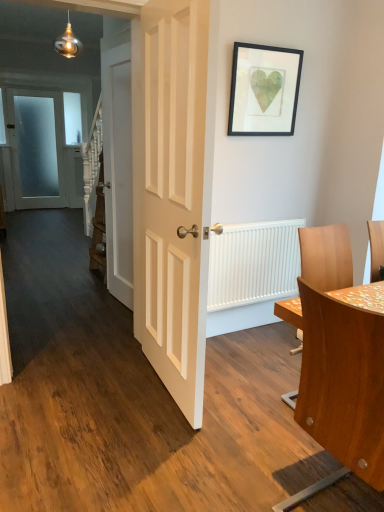
Question: Can you confirm if frosted glass door at left, the 3th door in the right-to-left sequence, is smaller than white ribbed radiator at right?

Choices:
 (A) no
 (B) yes

Answer: (A)

Question: From the image's perspective, would you say frosted glass door at left, the 1th door viewed from the left, is shown under white ribbed radiator at right?

Choices:
 (A) no
 (B) yes

Answer: (A)

Question: Does frosted glass door at left, marked as the third door in a front-to-back arrangement, lie behind white ribbed radiator at right?

Choices:
 (A) yes
 (B) no

Answer: (A)

Question: Can you confirm if frosted glass door at left, the 3th door in the right-to-left sequence, is positioned to the right of white ribbed radiator at right?

Choices:
 (A) no
 (B) yes

Answer: (A)

Question: Does frosted glass door at left, marked as the third door in a front-to-back arrangement, have a lesser height compared to white ribbed radiator at right?

Choices:
 (A) yes
 (B) no

Answer: (B)

Question: From the image's perspective, is frosted glass door at left, which is the 1th door from back to front, located above or below white glossy door at center, the first door when ordered from front to back?

Choices:
 (A) above
 (B) below

Answer: (A)

Question: Relative to white glossy door at center, the third door from the back, is frosted glass door at left, the 1th door viewed from the left, in front or behind?

Choices:
 (A) front
 (B) behind

Answer: (B)

Question: Is frosted glass door at left, marked as the third door in a front-to-back arrangement, bigger or smaller than white glossy door at center, which appears as the 1th door when viewed from the right?

Choices:
 (A) big
 (B) small

Answer: (B)

Question: From a real-world perspective, relative to white glossy door at center, the 3th door viewed from the left, is frosted glass door at left, which is the 1th door from back to front, vertically above or below?

Choices:
 (A) above
 (B) below

Answer: (B)

Question: From the image's perspective, is white ribbed radiator at right above or below white wooden door at center, acting as the 2th door starting from the left?

Choices:
 (A) below
 (B) above

Answer: (A)

Question: Relative to white wooden door at center, acting as the second door starting from the back, is white ribbed radiator at right in front or behind?

Choices:
 (A) front
 (B) behind

Answer: (A)

Question: Is point 238,268 closer or farther from the camera than point 122,174?

Choices:
 (A) closer
 (B) farther

Answer: (A)

Question: From a real-world perspective, is white ribbed radiator at right physically located above or below white wooden door at center, which is the second door from front to back?

Choices:
 (A) above
 (B) below

Answer: (B)

Question: Based on their sizes in the image, would you say white ribbed radiator at right is bigger or smaller than wooden table at right?

Choices:
 (A) big
 (B) small

Answer: (B)

Question: From their relative heights in the image, would you say white ribbed radiator at right is taller or shorter than wooden table at right?

Choices:
 (A) short
 (B) tall

Answer: (B)